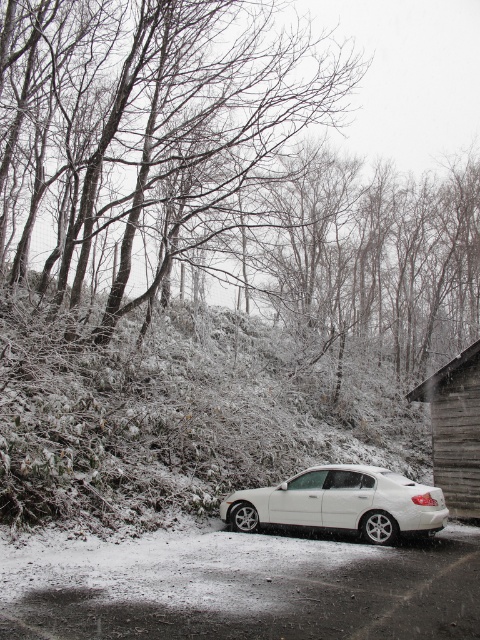
You are standing at the bottom of the hill and see the white matte sedan at center and the wooden cabin at right. Which object is closer to you?

The white matte sedan at center is closer to the viewer than the wooden cabin at right.

You are standing at the point with coordinates point (x=458, y=481) and want to walk to the point with coordinates point (x=276, y=493). Which direction should you move?

You should move downward because point (x=276, y=493) is in front of point (x=458, y=481), which means it is located below it.